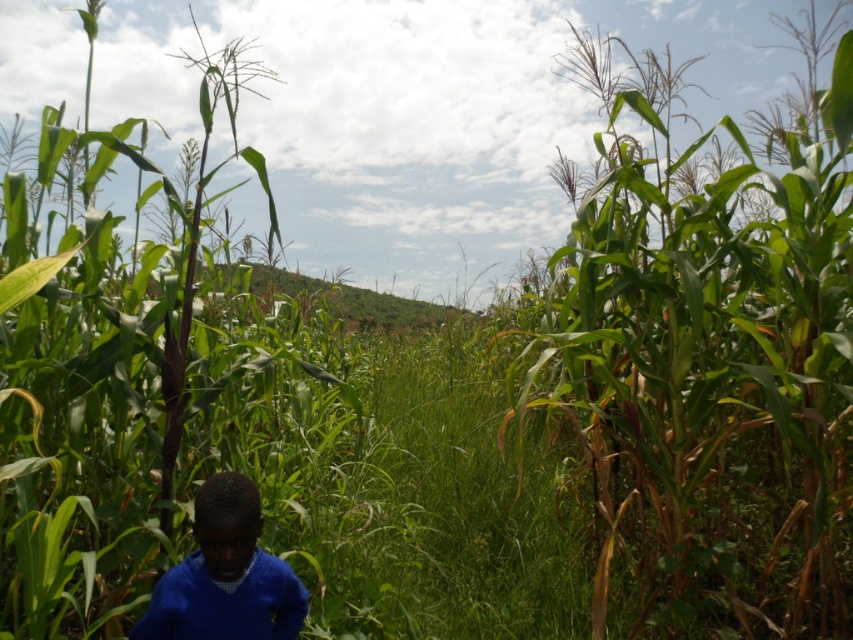
Identify the location of green leafy corn at center. (712, 368).

Does green leafy corn at center have a lesser width compared to blue sweater at lower left?

In fact, green leafy corn at center might be wider than blue sweater at lower left.

Does point (704, 280) come in front of point (143, 636)?

That is False.

At what (x,y) coordinates should I click in order to perform the action: click on green leafy corn at center. Please return your answer as a coordinate pair (x, y). The height and width of the screenshot is (640, 853). Looking at the image, I should click on coord(712,368).